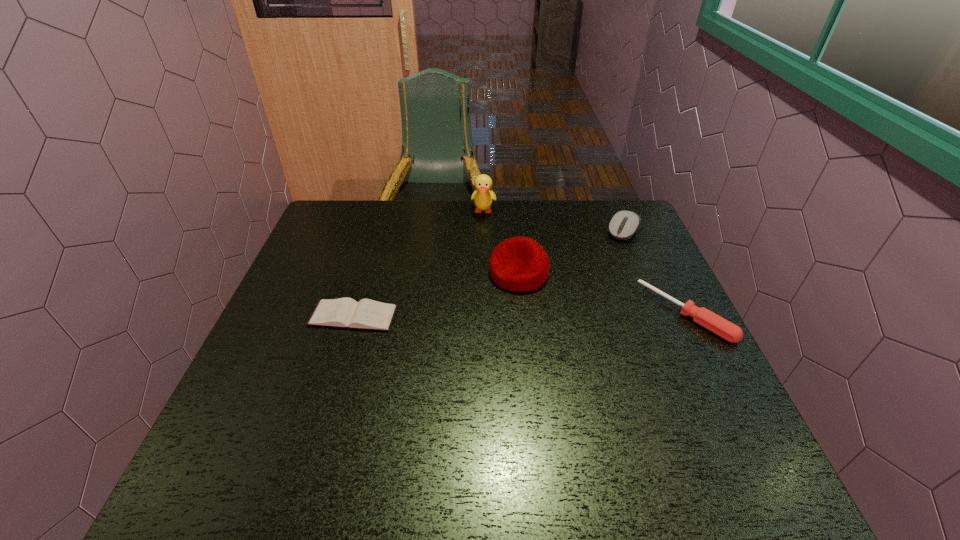
I want to click on vacant space on the desktop that is between the leftmost object and the screwdriver and is positioned on the front-facing side of the duckling, so coord(476,315).

Where is `free spot on the desktop that is between the shortest object and the screwdriver and is positioned on the wheel side of the computer equipment`? Image resolution: width=960 pixels, height=540 pixels. free spot on the desktop that is between the shortest object and the screwdriver and is positioned on the wheel side of the computer equipment is located at coordinates (566, 314).

You are a GUI agent. You are given a task and a screenshot of the screen. Output one action in this format:
    pyautogui.click(x=<x>, y=<y>)
    Task: Click on the vacant space on the desktop that is between the leftmost object and the second shortest object and is positioned on the seat area of the beanbag
    Image resolution: width=960 pixels, height=540 pixels.
    Given the screenshot: What is the action you would take?
    pyautogui.click(x=475, y=315)